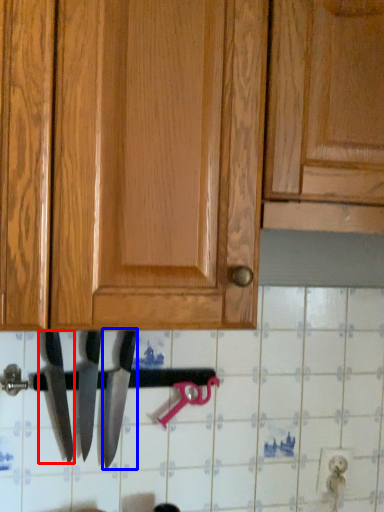
Question: Among these objects, which one is farthest to the camera, knife (highlighted by a red box) or knife (highlighted by a blue box)?

Choices:
 (A) knife
 (B) knife

Answer: (B)